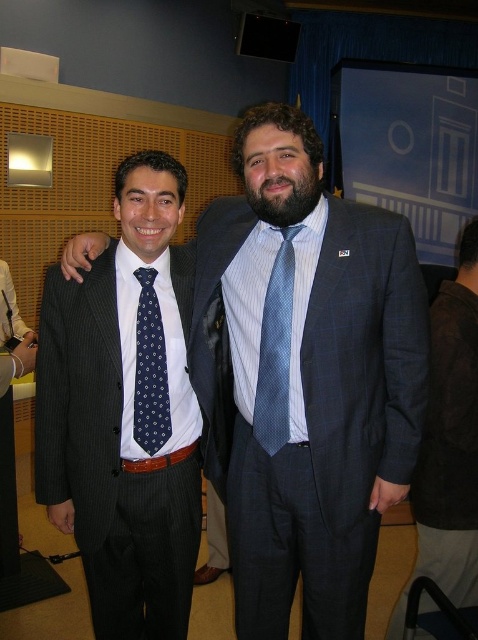
Question: Can you confirm if pinstriped suit at left is positioned to the left of blue textured suit at right?

Choices:
 (A) no
 (B) yes

Answer: (B)

Question: Does blue textured suit at right have a smaller size compared to navy dotted tie at center?

Choices:
 (A) no
 (B) yes

Answer: (A)

Question: Among these points, which one is farthest from the camera?

Choices:
 (A) (174, 280)
 (B) (275, 598)
 (C) (149, 310)
 (D) (430, 545)

Answer: (D)

Question: Which point is closer to the camera taking this photo?

Choices:
 (A) (129, 285)
 (B) (455, 384)
 (C) (274, 449)

Answer: (C)

Question: Does blue textured suit at center lie in front of blue dotted tie at center?

Choices:
 (A) no
 (B) yes

Answer: (B)

Question: Which of the following is the closest to the observer?

Choices:
 (A) (451, 477)
 (B) (262, 339)
 (C) (158, 368)

Answer: (B)